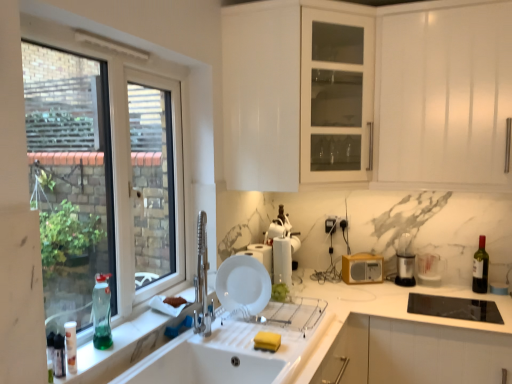
This screenshot has height=384, width=512. Find the location of `vacant region under white plastic window at left (from a real-world perspective)`. vacant region under white plastic window at left (from a real-world perspective) is located at coordinates (140, 305).